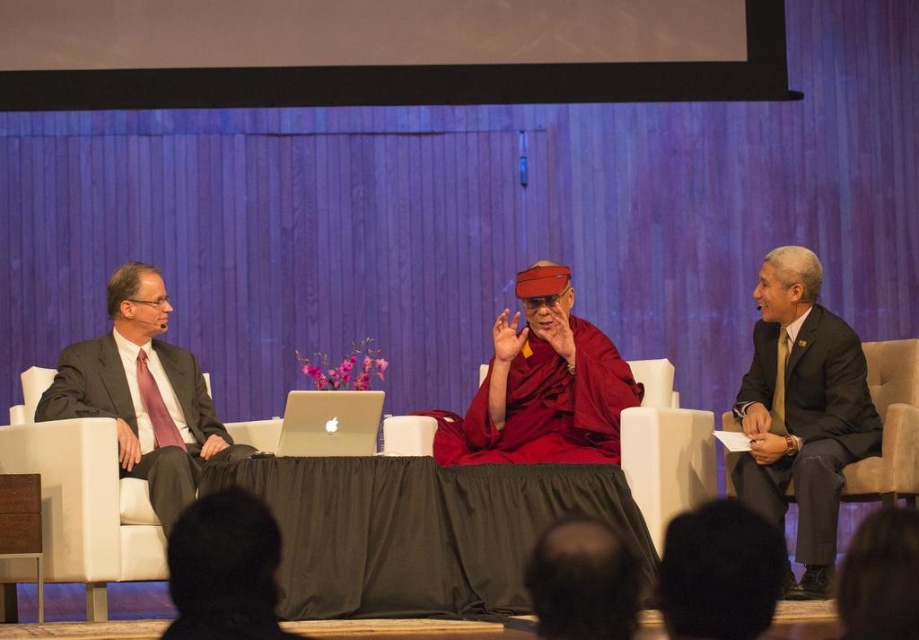
Question: Can you confirm if red silk robe at center is positioned above silver metallic laptop at center?

Choices:
 (A) yes
 (B) no

Answer: (A)

Question: Which point is farther from the camera taking this photo?

Choices:
 (A) (509, 321)
 (B) (827, 324)

Answer: (A)

Question: Does dark gray suit at right appear on the right side of dark gray suit at left?

Choices:
 (A) no
 (B) yes

Answer: (B)

Question: Does dark gray suit at right appear on the left side of dark gray suit at left?

Choices:
 (A) yes
 (B) no

Answer: (B)

Question: Which of these objects is positioned closest to the red silk robe at center?

Choices:
 (A) dark gray suit at left
 (B) silver metallic laptop at center

Answer: (B)

Question: Which object is the farthest from the dark gray suit at left?

Choices:
 (A) red silk robe at center
 (B) silver metallic laptop at center

Answer: (A)